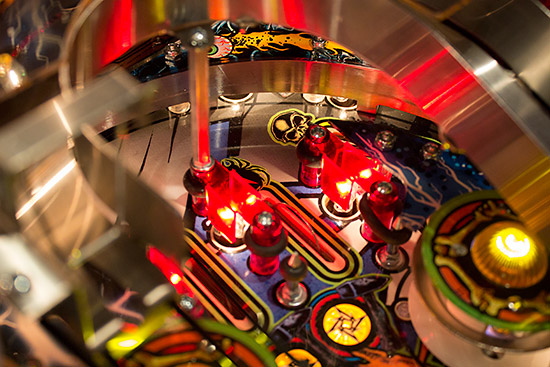
You are a GUI agent. You are given a task and a screenshot of the screen. Output one action in this format:
    pyautogui.click(x=<x>, y=<y>)
    Task: Click on the knob
    This screenshot has height=367, width=550.
    Given the screenshot: What is the action you would take?
    pyautogui.click(x=491, y=259)